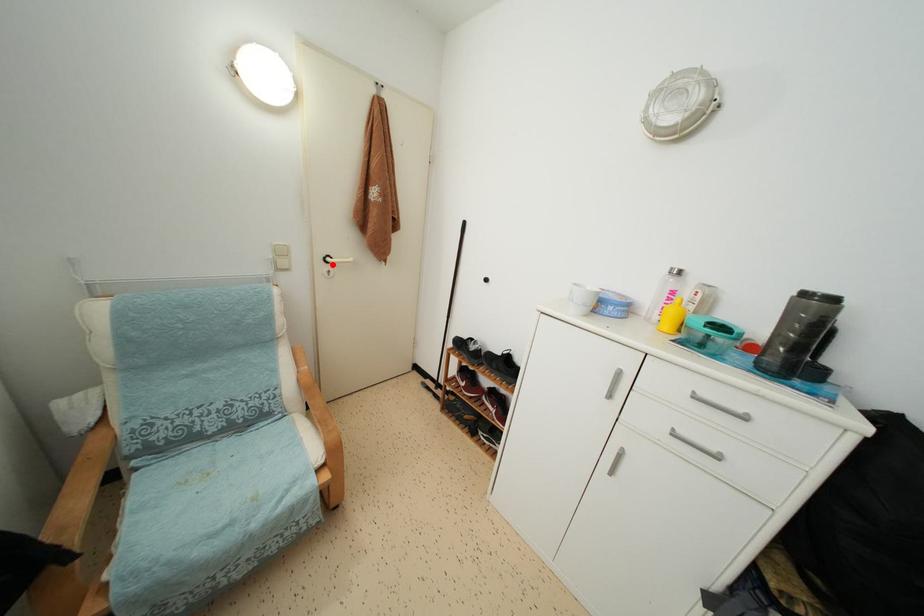
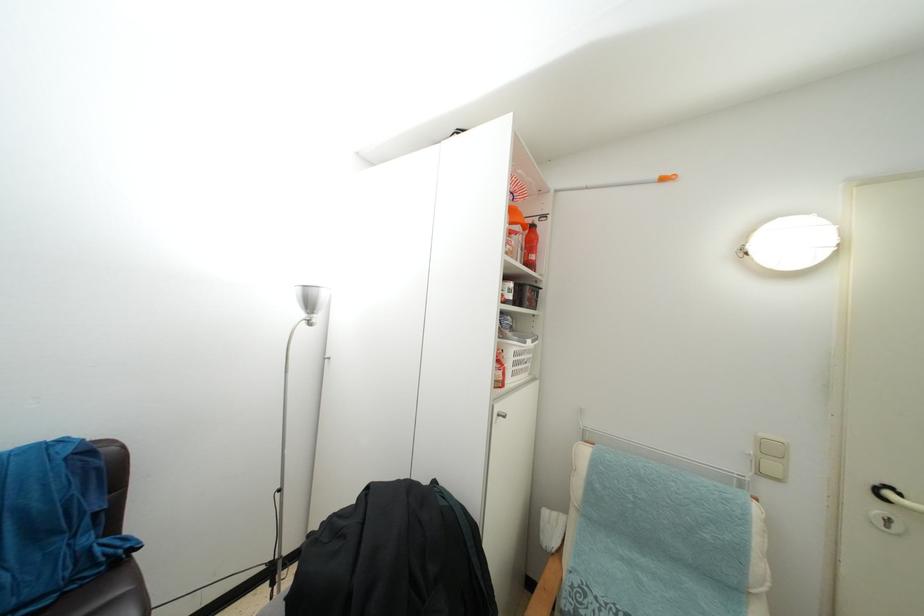
Find the pixel in the second image that matches the highlighted location in the first image.

(893, 500)